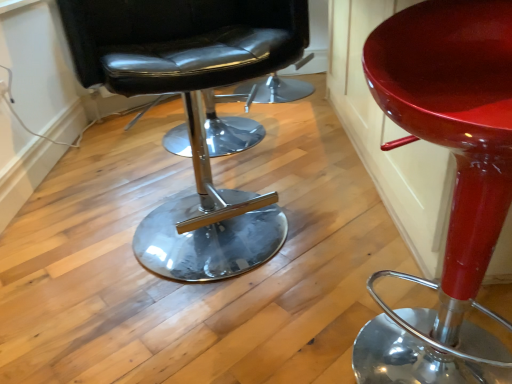
Question: Should I look upward or downward to see glossy red stool at center, placed as the second chair when sorted from left to right?

Choices:
 (A) up
 (B) down

Answer: (B)

Question: In which direction should I rotate to look at black leather chair at center, which is counted as the 1th chair, starting from the left?

Choices:
 (A) left
 (B) right

Answer: (A)

Question: From a real-world perspective, is black leather chair at center, placed as the 2th chair when sorted from right to left, positioned under glossy red stool at center, acting as the 1th chair starting from the right, based on gravity?

Choices:
 (A) no
 (B) yes

Answer: (A)

Question: From the image's perspective, is black leather chair at center, which is counted as the 1th chair, starting from the left, above glossy red stool at center, placed as the second chair when sorted from left to right?

Choices:
 (A) no
 (B) yes

Answer: (B)

Question: Is black leather chair at center, which is counted as the 1th chair, starting from the left, bigger than glossy red stool at center, placed as the second chair when sorted from left to right?

Choices:
 (A) no
 (B) yes

Answer: (B)

Question: Does black leather chair at center, placed as the 2th chair when sorted from right to left, have a smaller size compared to glossy red stool at center, placed as the second chair when sorted from left to right?

Choices:
 (A) no
 (B) yes

Answer: (A)

Question: Would you say black leather chair at center, placed as the 2th chair when sorted from right to left, contains glossy red stool at center, placed as the second chair when sorted from left to right?

Choices:
 (A) no
 (B) yes

Answer: (A)

Question: Is black leather chair at center, which is counted as the 1th chair, starting from the left, taller than glossy red stool at center, acting as the 1th chair starting from the right?

Choices:
 (A) yes
 (B) no

Answer: (A)

Question: Does glossy red stool at center, placed as the second chair when sorted from left to right, come behind black leather chair at center, placed as the 2th chair when sorted from right to left?

Choices:
 (A) yes
 (B) no

Answer: (B)

Question: Does glossy red stool at center, placed as the second chair when sorted from left to right, have a larger size compared to black leather chair at center, which is counted as the 1th chair, starting from the left?

Choices:
 (A) no
 (B) yes

Answer: (A)

Question: Considering the relative positions of glossy red stool at center, acting as the 1th chair starting from the right, and black leather chair at center, which is counted as the 1th chair, starting from the left, in the image provided, is glossy red stool at center, acting as the 1th chair starting from the right, to the right of black leather chair at center, which is counted as the 1th chair, starting from the left, from the viewer's perspective?

Choices:
 (A) no
 (B) yes

Answer: (B)

Question: Is glossy red stool at center, acting as the 1th chair starting from the right, aimed at black leather chair at center, placed as the 2th chair when sorted from right to left?

Choices:
 (A) no
 (B) yes

Answer: (A)

Question: From a real-world perspective, is glossy red stool at center, placed as the second chair when sorted from left to right, located beneath black leather chair at center, placed as the 2th chair when sorted from right to left?

Choices:
 (A) yes
 (B) no

Answer: (A)

Question: Is glossy red stool at center, acting as the 1th chair starting from the right, in front of black leather chair at center, which is counted as the 1th chair, starting from the left?

Choices:
 (A) yes
 (B) no

Answer: (A)

Question: Does point (154, 271) appear closer or farther from the camera than point (480, 142)?

Choices:
 (A) farther
 (B) closer

Answer: (A)